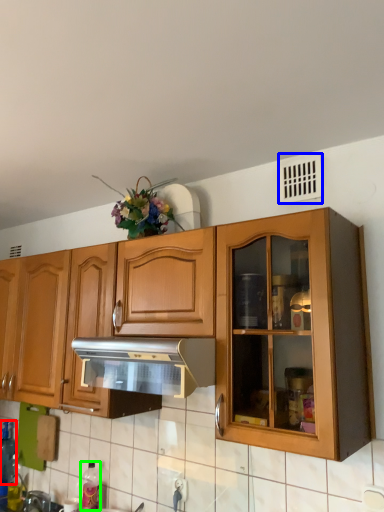
Question: Which is farther away from bottle (highlighted by a red box)? window (highlighted by a blue box) or bottle (highlighted by a green box)?

Choices:
 (A) window
 (B) bottle

Answer: (A)